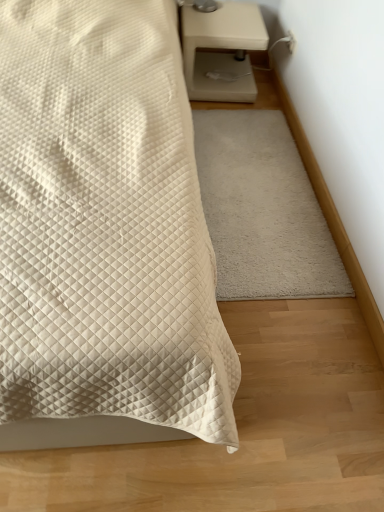
Question: From a real-world perspective, is white quilted bed at center physically located above or below beige matte nightstand at upper right?

Choices:
 (A) below
 (B) above

Answer: (B)

Question: Does point (110, 64) appear closer or farther from the camera than point (251, 87)?

Choices:
 (A) closer
 (B) farther

Answer: (A)

Question: Which of these objects is positioned farthest from the white soft rug at center?

Choices:
 (A) white quilted bed at center
 (B) beige matte nightstand at upper right

Answer: (A)

Question: Estimate the real-world distances between objects in this image. Which object is farther from the white quilted bed at center?

Choices:
 (A) white soft rug at center
 (B) beige matte nightstand at upper right

Answer: (B)